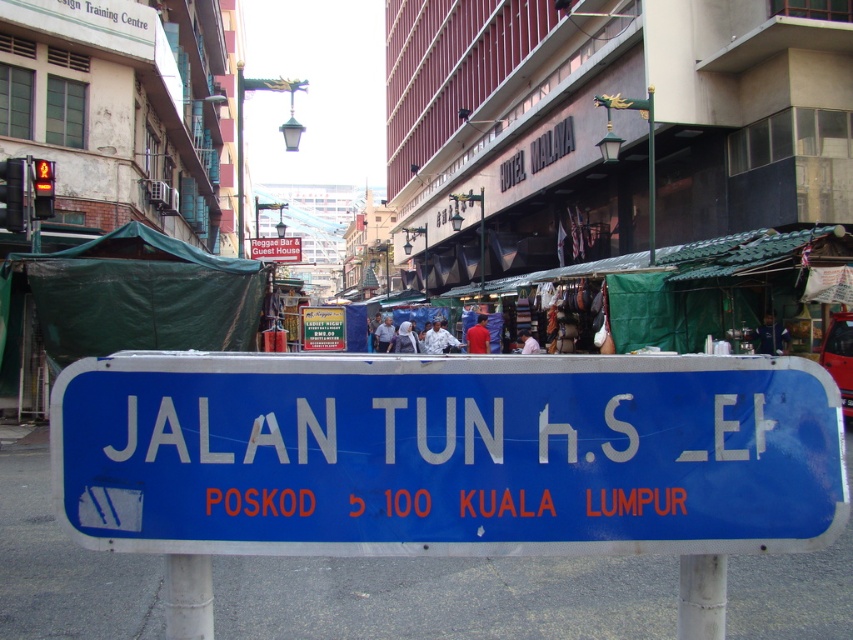
Question: Can you confirm if blue metallic sign at center is thinner than blue plastic sign at center?

Choices:
 (A) yes
 (B) no

Answer: (A)

Question: Can you confirm if blue metallic sign at center is bigger than white fabric at center?

Choices:
 (A) yes
 (B) no

Answer: (B)

Question: Which point is closer to the camera?

Choices:
 (A) blue plastic sign at center
 (B) blue metallic sign at center

Answer: (B)

Question: Among these points, which one is nearest to the camera?

Choices:
 (A) (267, 246)
 (B) (402, 307)

Answer: (A)

Question: Is blue metallic sign at center positioned in front of blue plastic sign at center?

Choices:
 (A) no
 (B) yes

Answer: (B)

Question: Which point is farther to the camera?

Choices:
 (A) (251, 243)
 (B) (799, 435)
 (C) (492, 346)

Answer: (A)